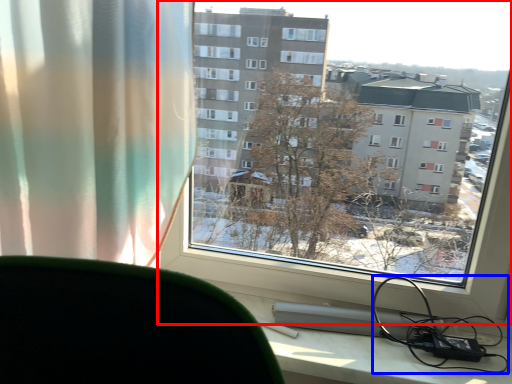
Question: Which point is closer to the camera, window (highlighted by a red box) or cable (highlighted by a blue box)?

Choices:
 (A) window
 (B) cable

Answer: (A)